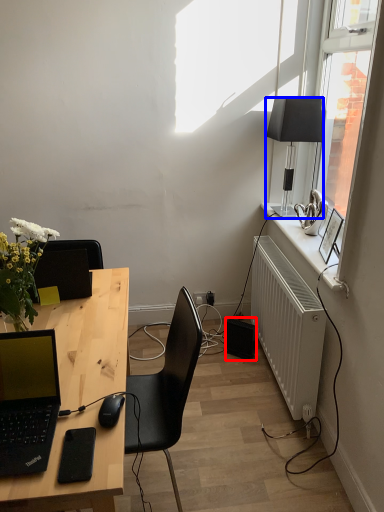
Question: Which object is further to the camera taking this photo, speaker (highlighted by a red box) or lamp (highlighted by a blue box)?

Choices:
 (A) speaker
 (B) lamp

Answer: (A)